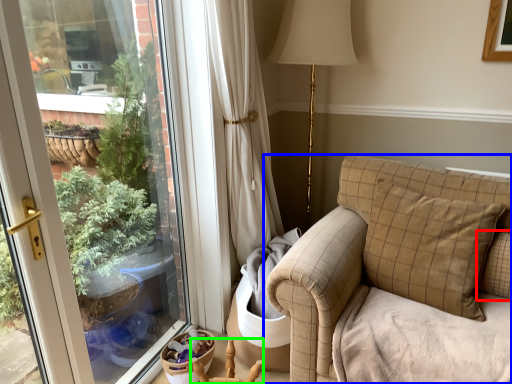
Question: Which object is positioned farthest from pillow (highlighted by a red box)? Select from studio couch (highlighted by a blue box) and armchair (highlighted by a green box).

Choices:
 (A) studio couch
 (B) armchair

Answer: (B)